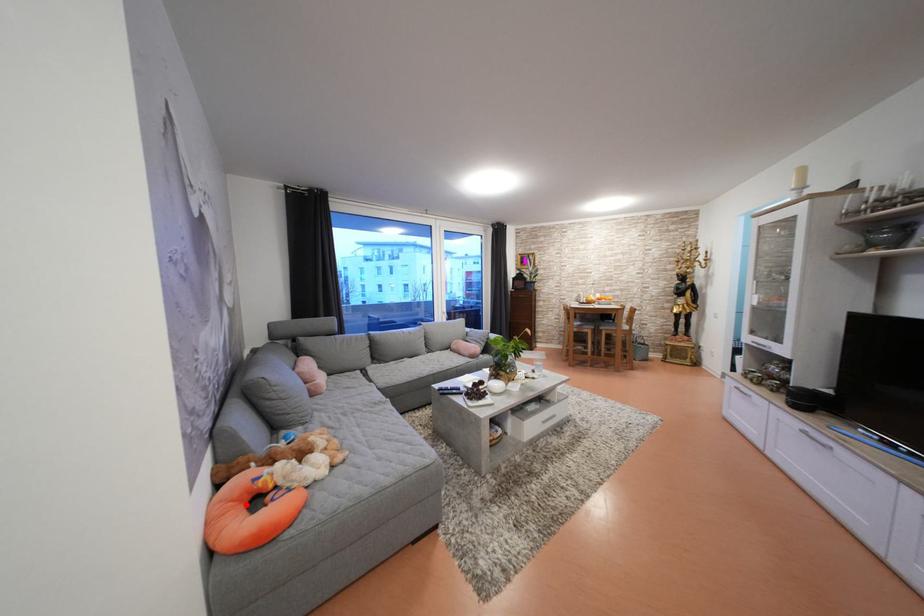
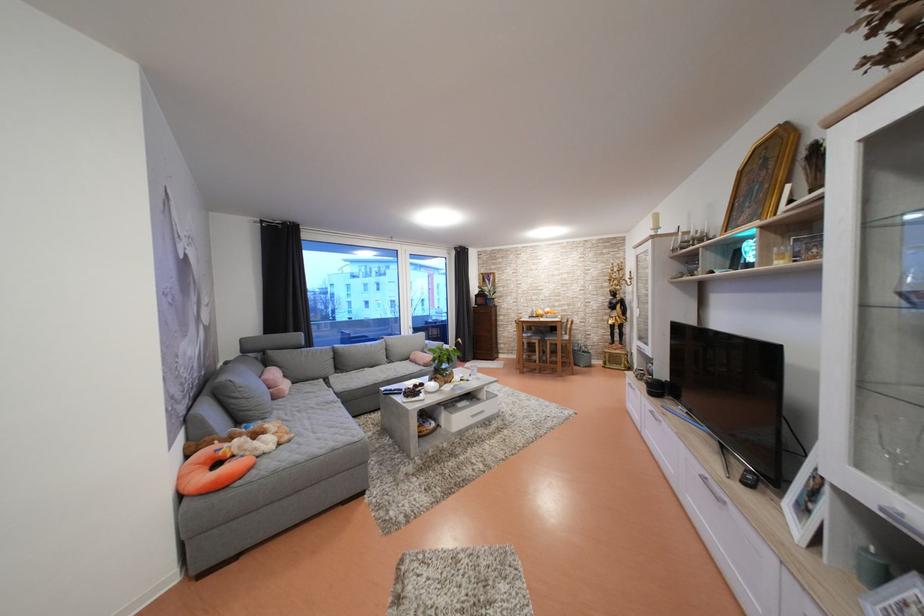
In the second image, find the point that corresponds to the highlighted location in the first image.

(211, 469)